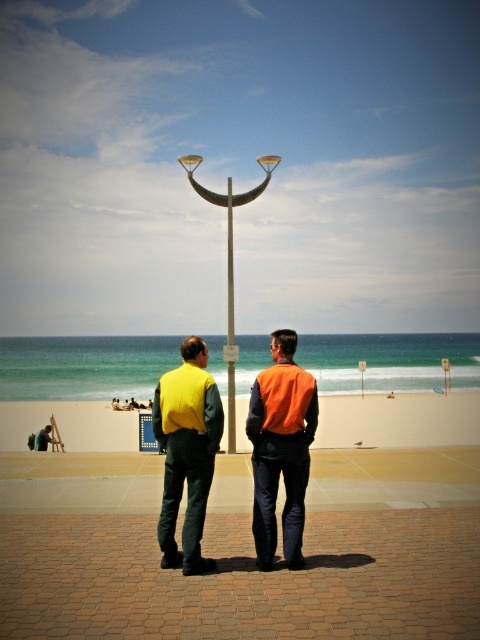
You are a pedestrian walking on the beach and see two people wearing high visibility vests. You notice a matte yellow vest at center and a matte yellow vest at lower left. Which vest is located to the right of the other?

The matte yellow vest at center is positioned on the right side of matte yellow vest at lower left.

You are a photographer standing at the beach scene. You want to capture both the matte orange vest at center and the matte yellow vest at lower left in a single photo. Which vest will appear larger in the photo?

The matte orange vest at center will appear larger in the photo because it is much taller than the matte yellow vest at lower left.